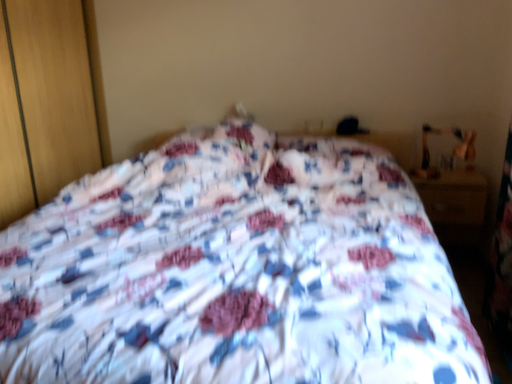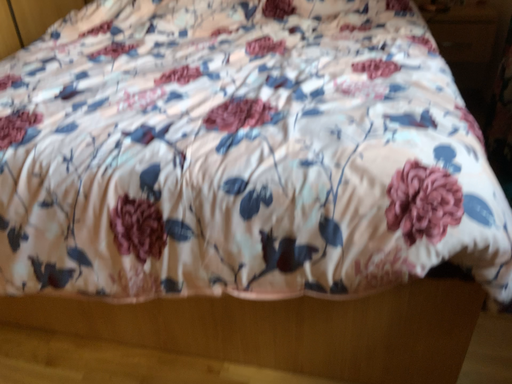
Question: Which way did the camera rotate in the video?

Choices:
 (A) rotated downward
 (B) rotated upward

Answer: (A)